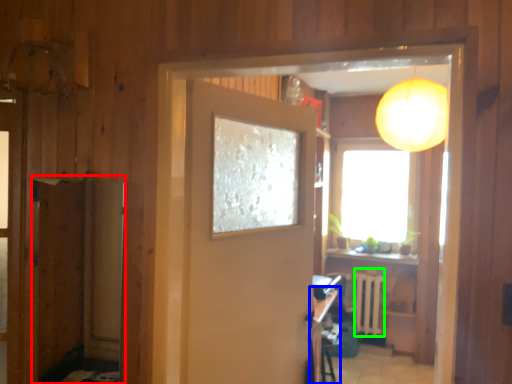
Question: Which is nearer to the screen door (highlighted by a red box)? table (highlighted by a blue box) or radiator (highlighted by a green box).

Choices:
 (A) table
 (B) radiator

Answer: (A)